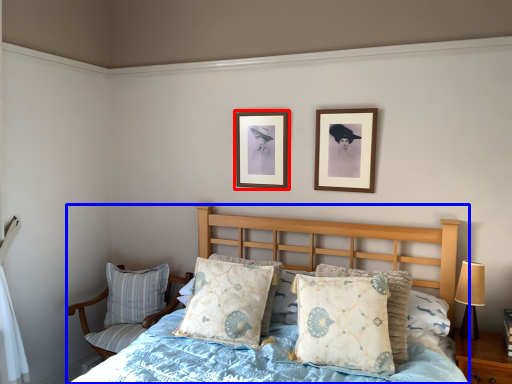
Question: Among these objects, which one is farthest to the camera, picture frame (highlighted by a red box) or bed (highlighted by a blue box)?

Choices:
 (A) picture frame
 (B) bed

Answer: (A)